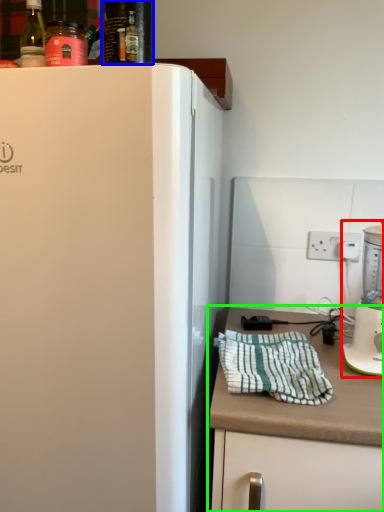
Question: Estimate the real-world distances between objects in this image. Which object is closer to blender (highlighted by a red box), beverage (highlighted by a blue box) or countertop (highlighted by a green box)?

Choices:
 (A) beverage
 (B) countertop

Answer: (B)